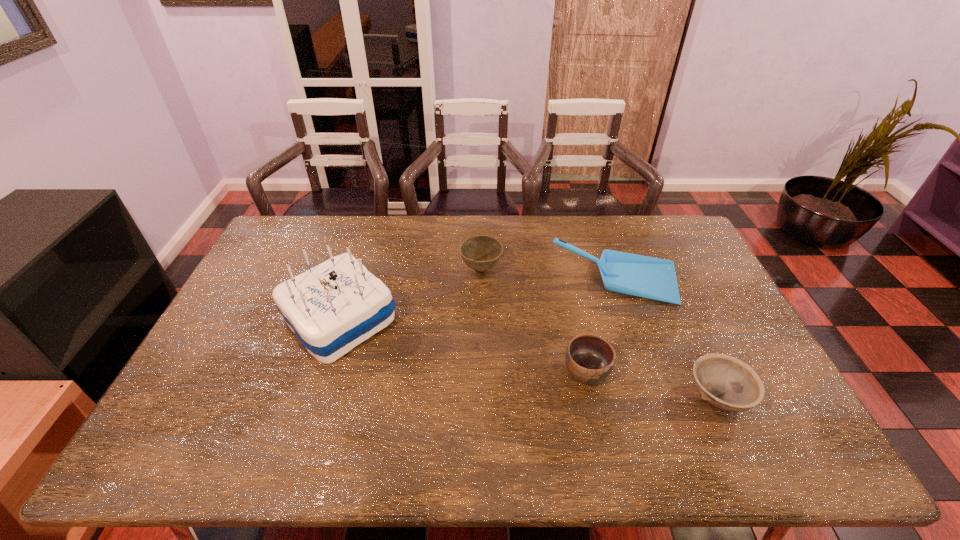
Where is `free point between the second bowl from left to right and the rightmost bowl`? free point between the second bowl from left to right and the rightmost bowl is located at coordinates (652, 384).

This screenshot has width=960, height=540. Find the location of `vacant area between the dustpan and the rightmost bowl`. vacant area between the dustpan and the rightmost bowl is located at coordinates (667, 339).

This screenshot has width=960, height=540. I want to click on free area in between the rightmost bowl and the second bowl from right to left, so click(652, 384).

The image size is (960, 540). Find the location of `free space that is in between the rightmost bowl and the birthday cake`. free space that is in between the rightmost bowl and the birthday cake is located at coordinates click(x=528, y=358).

Image resolution: width=960 pixels, height=540 pixels. I want to click on free space between the fourth shortest object and the second bowl from left to right, so click(602, 327).

Where is `free spot between the rightmost bowl and the fourth object from right to left`? free spot between the rightmost bowl and the fourth object from right to left is located at coordinates (599, 333).

This screenshot has height=540, width=960. Identify the location of free spot between the leftmost bowl and the second bowl from left to right. (534, 321).

This screenshot has height=540, width=960. I want to click on unoccupied area between the second bowl from right to left and the rightmost bowl, so [652, 384].

The image size is (960, 540). I want to click on free space between the birthday cake and the dustpan, so click(478, 300).

Locate an element on the screen. The width and height of the screenshot is (960, 540). the second closest object to the leftmost object is located at coordinates (589, 358).